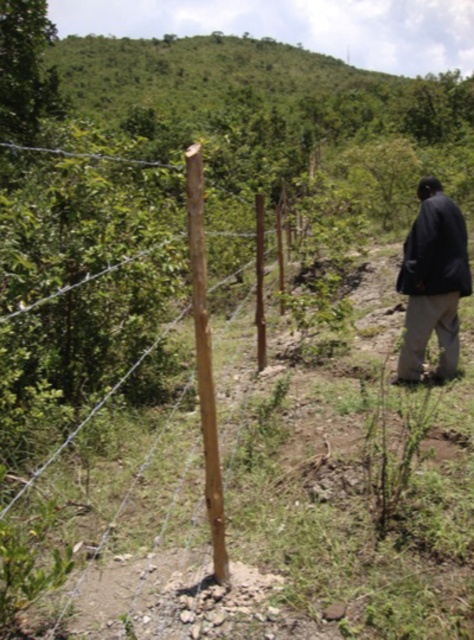
You are standing at the center of the image and want to walk towards the dark blue jacket at lower right. Which direction should you move relative to the brown rough wood post at center?

You should move to the right relative to the brown rough wood post at center because the dark blue jacket at lower right is located to the right of the brown rough wood post at center.

You are standing at the camera position and want to reach the point marked at coordinates point (56, 452). Considering the barbed wire fence in front of you, can you walk directly to that point without crossing the fence?

The distance of point (56, 452) from camera is 4.58 meters. Since the barbed wire fence is running diagonally across the frame, you would need to navigate around it to reach the point without crossing the fence. However, the exact path isn

You are a photographer trying to capture the brown rough wood post at center and the dark blue jacket at lower right in the same frame. Based on their heights, which object should you focus on first to ensure both are in focus?

The brown rough wood post at center is taller than the dark blue jacket at lower right, so focusing on the brown rough wood post at center first will help ensure both are in focus since it is the taller object.